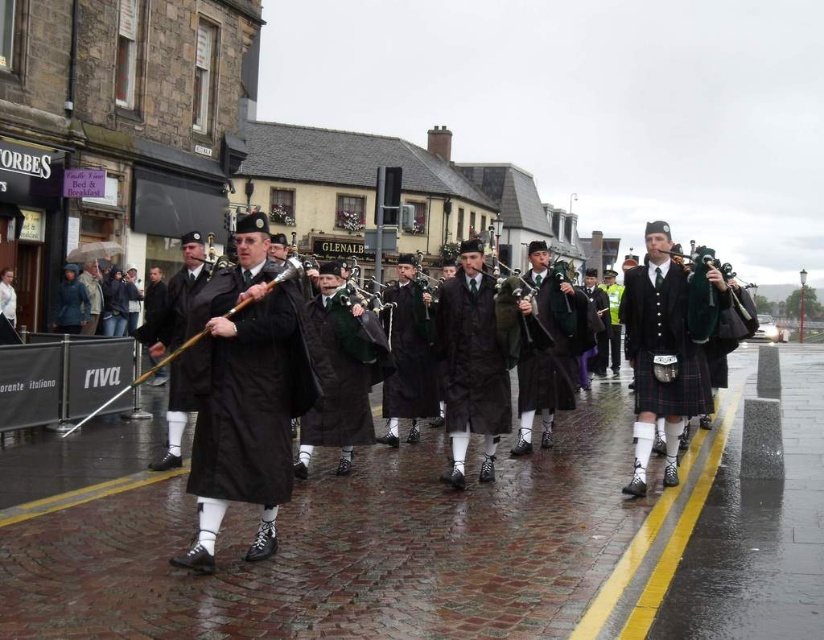
Question: Which point appears closest to the camera in this image?

Choices:
 (A) (314, 333)
 (B) (565, 307)

Answer: (A)

Question: Which object is positioned closest to the green matte bagpipe at center?

Choices:
 (A) dark green wool kilt at center
 (B) green woolen kilt at center

Answer: (B)

Question: Does plaid fabric kilt at right have a larger size compared to wooden bagpipe at center?

Choices:
 (A) yes
 (B) no

Answer: (A)

Question: Is dark brown leather coat at center below green velvet bagpipe at center?

Choices:
 (A) no
 (B) yes

Answer: (B)

Question: Among these points, which one is farthest from the camera?

Choices:
 (A) (370, 358)
 (B) (427, 278)

Answer: (B)

Question: In this image, where is green matte bagpipe at center located relative to matte green bagpipe at center?

Choices:
 (A) right
 (B) left

Answer: (B)